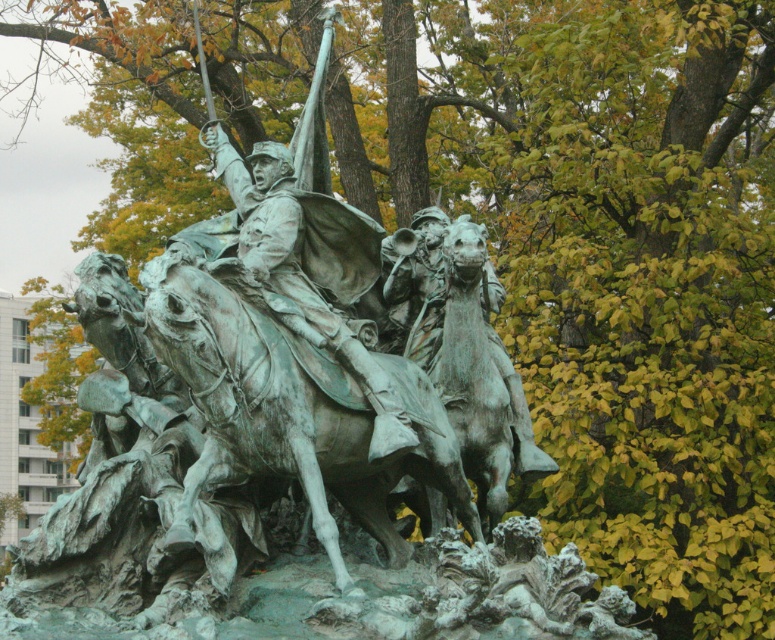
Question: Which of the following is the closest to the observer?

Choices:
 (A) green patina horse at center
 (B) green patina statue at center

Answer: (A)

Question: Can you confirm if green patina horse at center is bigger than green patina statue at center?

Choices:
 (A) yes
 (B) no

Answer: (B)

Question: Which object is farther from the camera taking this photo?

Choices:
 (A) green patina horse at center
 (B) green patina statue at center

Answer: (B)

Question: Can you confirm if green patina horse at center is positioned below green patina statue at center?

Choices:
 (A) yes
 (B) no

Answer: (A)

Question: Can you confirm if green patina horse at center is positioned below green patina statue at center?

Choices:
 (A) yes
 (B) no

Answer: (A)